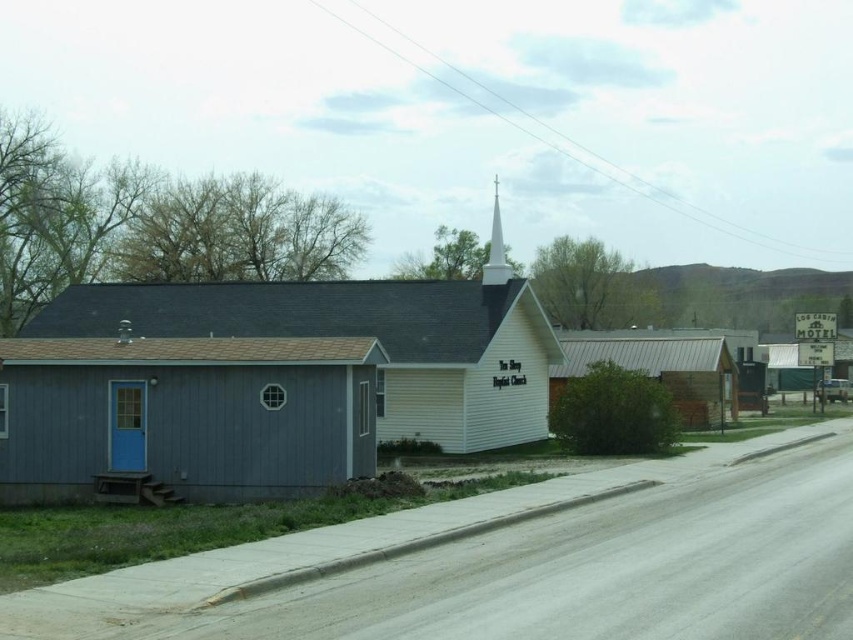
Describe the element at coordinates (184, 417) in the screenshot. I see `matte blue cabin at left` at that location.

Does matte blue cabin at left come in front of white smooth steeple at upper center?

Yes.

This screenshot has height=640, width=853. Identify the location of matte blue cabin at left. (184, 417).

Is point (693, 378) farther from camera compared to point (490, 244)?

No.

Does point (627, 342) lie in front of point (496, 188)?

Yes, it is.

Who is more forward, (721, 337) or (492, 243)?

Positioned in front is point (492, 243).

Find the location of a particular element. brown wood cabin at center is located at coordinates [660, 371].

Who is shorter, matte blue siding at center or brown wood cabin at center?

brown wood cabin at center

Can you confirm if matte blue siding at center is bigger than brown wood cabin at center?

No.

Where is `matte blue siding at center`? Image resolution: width=853 pixels, height=640 pixels. matte blue siding at center is located at coordinates (363, 337).

Find the location of `matte blue siding at center`. matte blue siding at center is located at coordinates (363, 337).